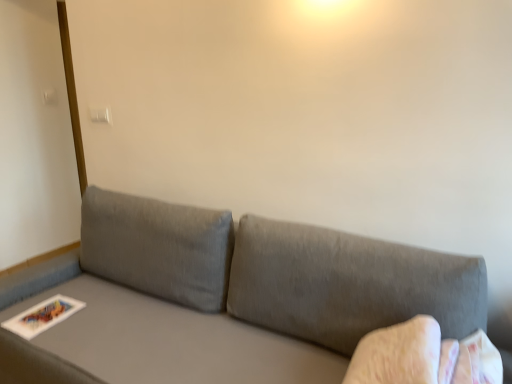
Identify the location of vacant region above white glossy magazine at lower left (from a real-world perspective). Image resolution: width=512 pixels, height=384 pixels. (50, 312).